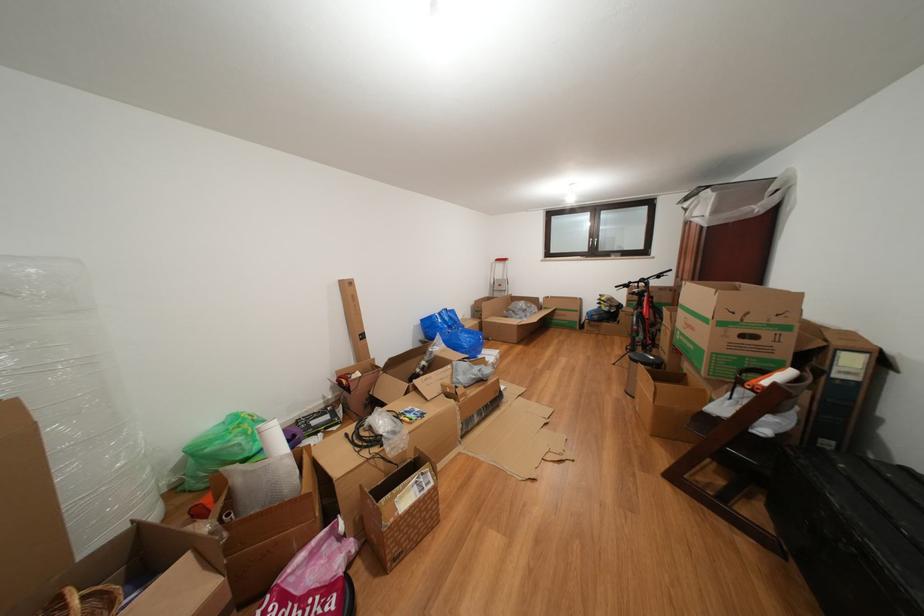
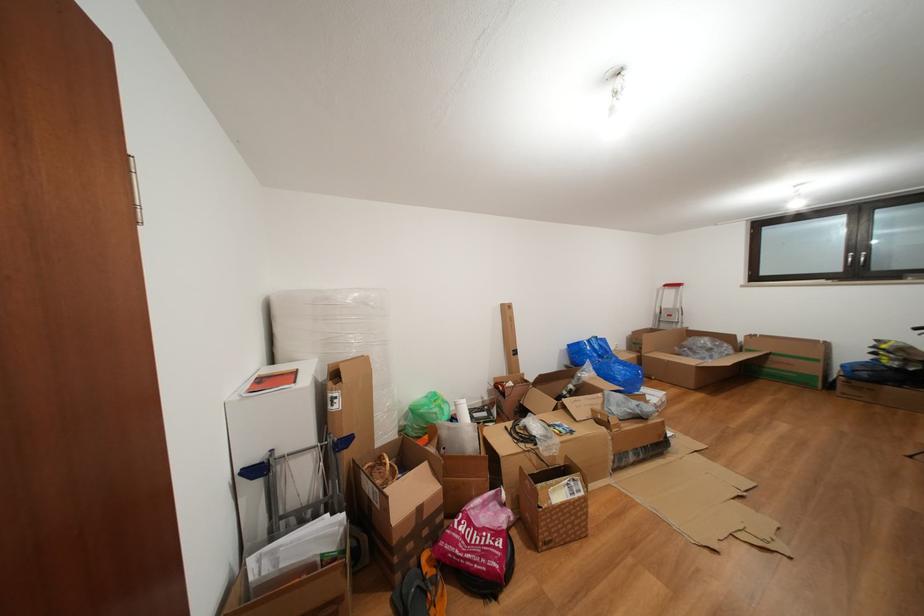
Locate, in the second image, the point that corresponds to [391,506] in the first image.

(546, 491)